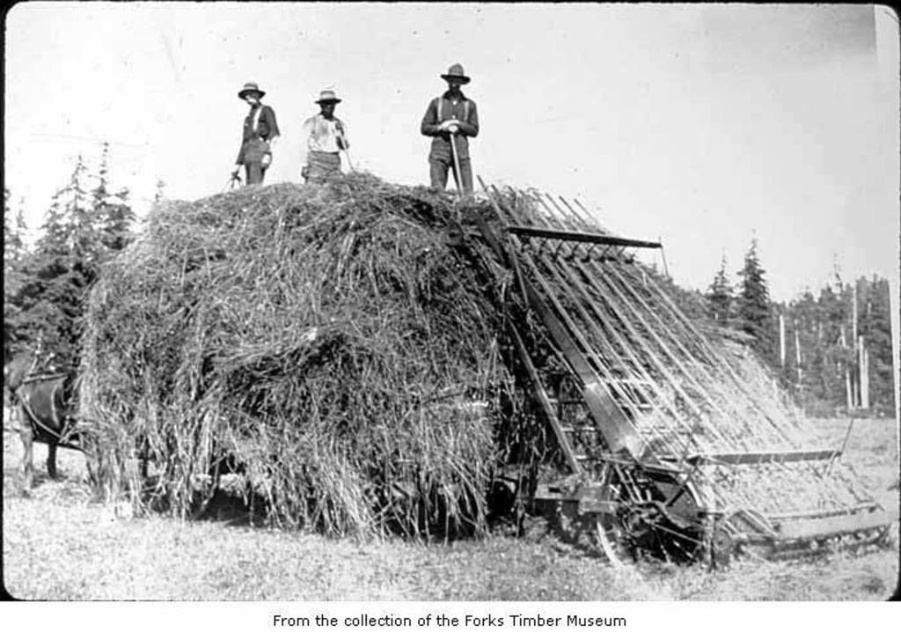
The image size is (901, 640). Find the location of `rugged brown leather hat at upper center`. rugged brown leather hat at upper center is located at coordinates (450, 132).

Between rugged brown leather hat at upper center and light brown wooden hat at center, which one has more height?

rugged brown leather hat at upper center

Identify the location of rugged brown leather hat at upper center. (450, 132).

Can you confirm if rugged brown leather hat at upper center is taller than rugged brown suit at upper center?

Yes, rugged brown leather hat at upper center is taller than rugged brown suit at upper center.

Which of these two, rugged brown leather hat at upper center or rugged brown suit at upper center, stands shorter?

Standing shorter between the two is rugged brown suit at upper center.

This screenshot has width=901, height=640. What do you see at coordinates (450, 132) in the screenshot? I see `rugged brown leather hat at upper center` at bounding box center [450, 132].

This screenshot has width=901, height=640. What are the coordinates of `rugged brown leather hat at upper center` in the screenshot? It's located at (450, 132).

Does light brown wooden hat at center come in front of rugged brown suit at upper center?

Yes, it is in front of rugged brown suit at upper center.

Consider the image. Is light brown wooden hat at center taller than rugged brown suit at upper center?

No.

Does point (305, 173) come in front of point (234, 161)?

That is True.

Locate an element on the screen. light brown wooden hat at center is located at coordinates (322, 140).